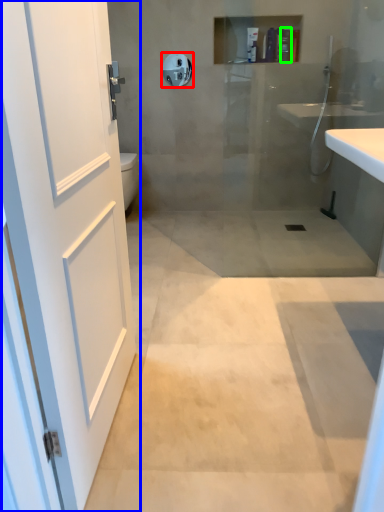
Question: Which object is positioned farthest from towel bar (highlighted by a red box)? Select from door (highlighted by a blue box) and toiletry (highlighted by a green box).

Choices:
 (A) door
 (B) toiletry

Answer: (A)